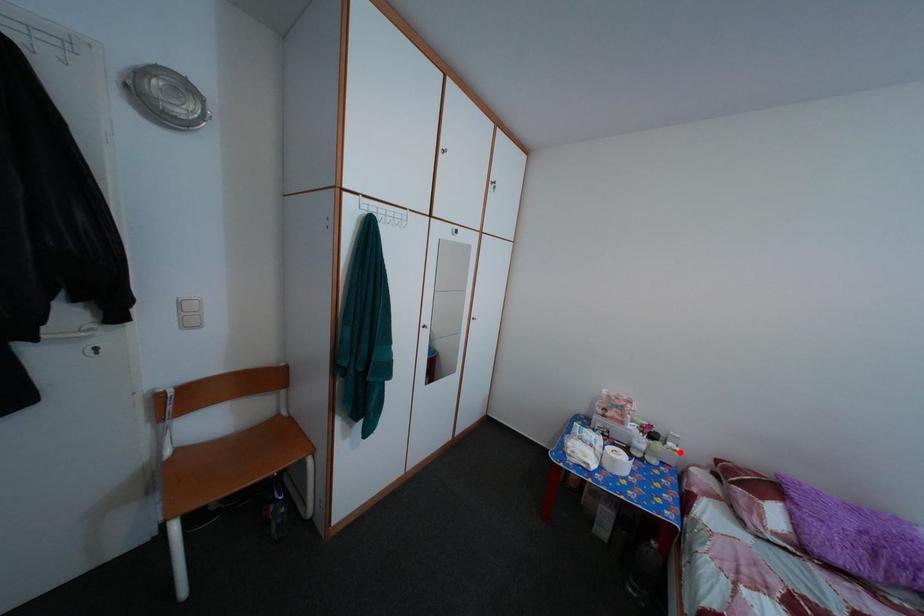
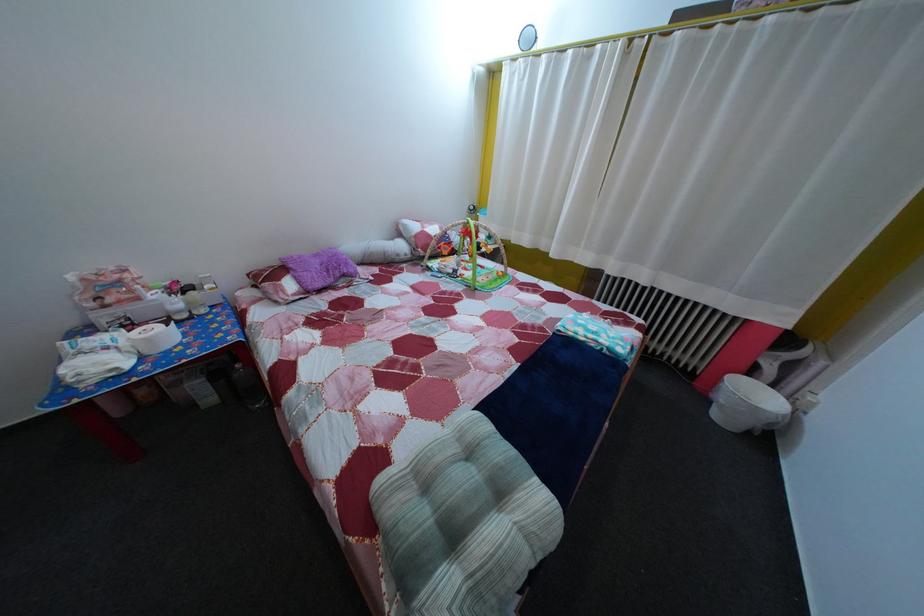
Find the pixel in the second image that matches the highlighted location in the first image.

(216, 294)